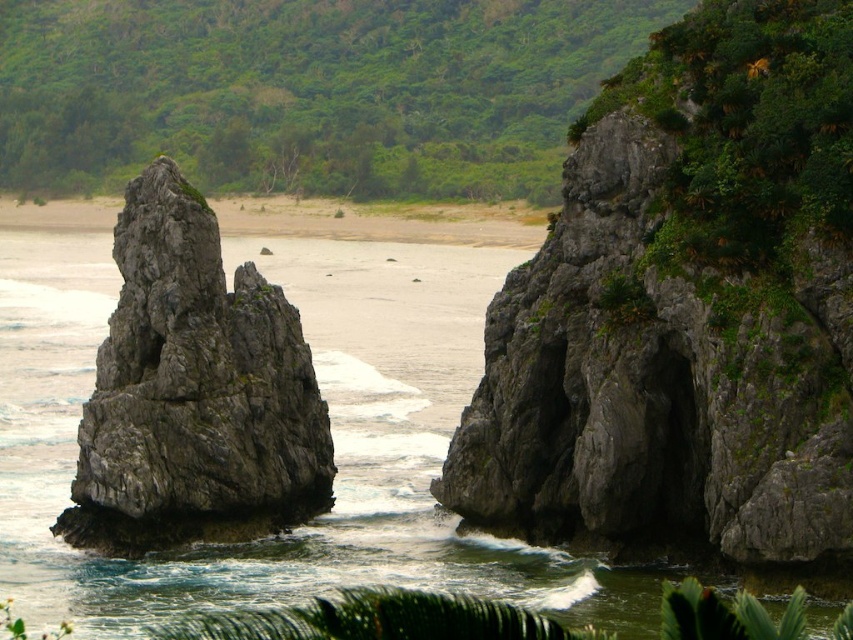
Between greenish water at center and green leafy vegetation at upper center, which one is positioned higher?

green leafy vegetation at upper center is higher up.

Between greenish water at center and green leafy vegetation at upper center, which one appears on the left side from the viewer's perspective?

green leafy vegetation at upper center is more to the left.

I want to click on greenish water at center, so click(x=323, y=397).

Locate an element on the screen. The height and width of the screenshot is (640, 853). greenish water at center is located at coordinates (323, 397).

Based on the photo, between gray rough rock at right and green leafy vegetation at upper center, which one appears on the right side from the viewer's perspective?

gray rough rock at right

Measure the distance between gray rough rock at right and camera.

The distance of gray rough rock at right from camera is 50.38 meters.

You are a GUI agent. You are given a task and a screenshot of the screen. Output one action in this format:
    pyautogui.click(x=<x>, y=<y>)
    Task: Click on the gray rough rock at right
    This screenshot has height=640, width=853.
    Given the screenshot: What is the action you would take?
    pyautogui.click(x=683, y=310)

Between gray rough rock at right and greenish water at center, which one is positioned lower?

gray rough rock at right is below.

Can you confirm if gray rough rock at right is positioned above greenish water at center?

No.

Describe the element at coordinates (683, 310) in the screenshot. I see `gray rough rock at right` at that location.

Identify the location of gray rough rock at right. (683, 310).